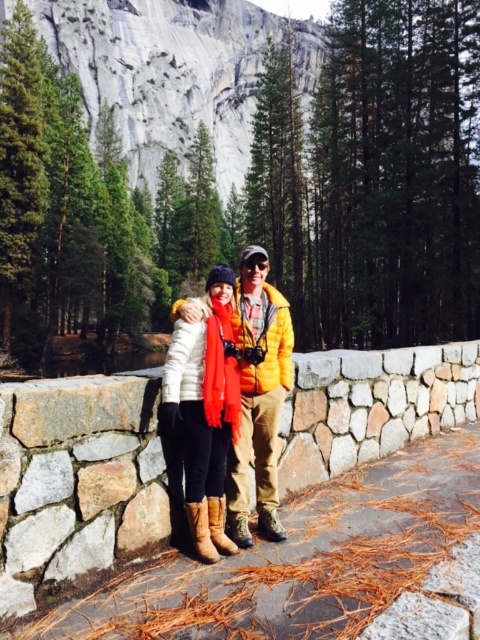
Is matte white rock at upper center taller than matte orange scarf at center?

Indeed, matte white rock at upper center has a greater height compared to matte orange scarf at center.

Identify the location of matte white rock at upper center. (166, 72).

The image size is (480, 640). What are the coordinates of `matte white rock at upper center` in the screenshot? It's located at (166, 72).

Find the location of `matte white rock at upper center`. matte white rock at upper center is located at coordinates (166, 72).

Find the location of a particular element. The height and width of the screenshot is (640, 480). brown suede boot at lower center is located at coordinates (201, 531).

Locate an element on the screen. This screenshot has height=640, width=480. brown suede boot at lower center is located at coordinates (201, 531).

From the picture: Does matte orange scarf at center appear on the left side of brown suede boot at lower center?

Incorrect, matte orange scarf at center is not on the left side of brown suede boot at lower center.

Does matte orange scarf at center have a lesser height compared to brown suede boot at lower center?

No.

Locate an element on the screen. This screenshot has width=480, height=640. matte orange scarf at center is located at coordinates (257, 394).

Locate an element on the screen. matte orange scarf at center is located at coordinates (257, 394).